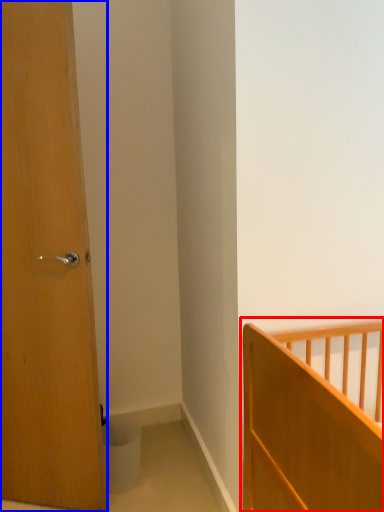
Question: Which object is closer to the camera taking this photo, bed (highlighted by a red box) or door (highlighted by a blue box)?

Choices:
 (A) bed
 (B) door

Answer: (A)